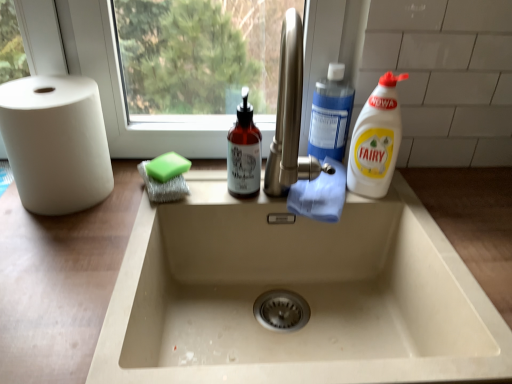
At what (x,y) coordinates should I click in order to perform the action: click on free space above white matte paper towel at left (from a real-world perspective). Please return your answer as a coordinate pair (x, y). Looking at the image, I should click on (41, 87).